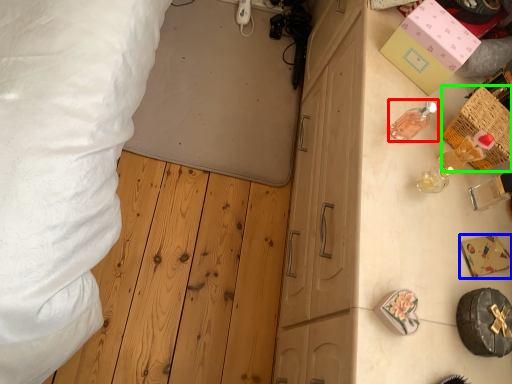
Question: Considering the real-world distances, which object is closest to toiletry (highlighted by a red box)? box (highlighted by a blue box) or crate (highlighted by a green box).

Choices:
 (A) box
 (B) crate

Answer: (B)